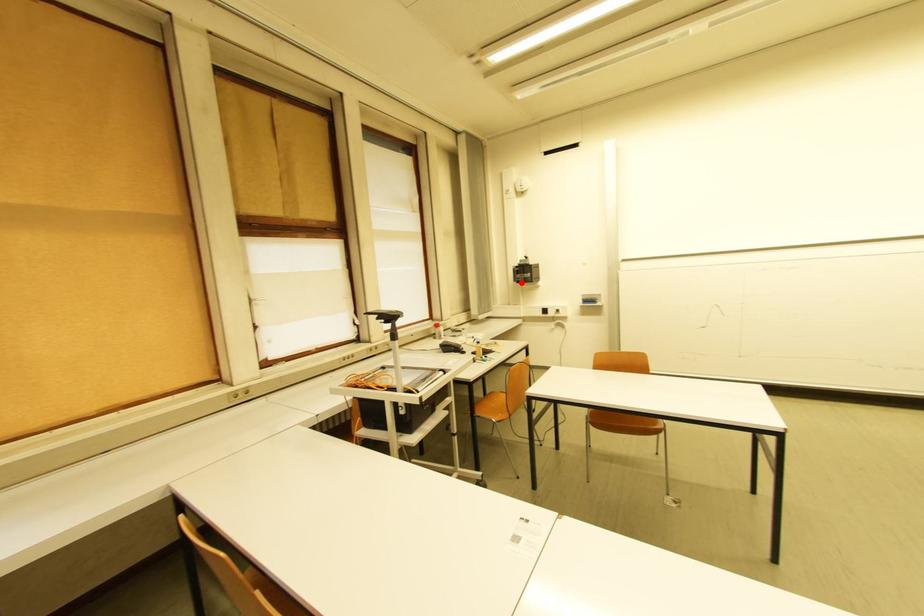
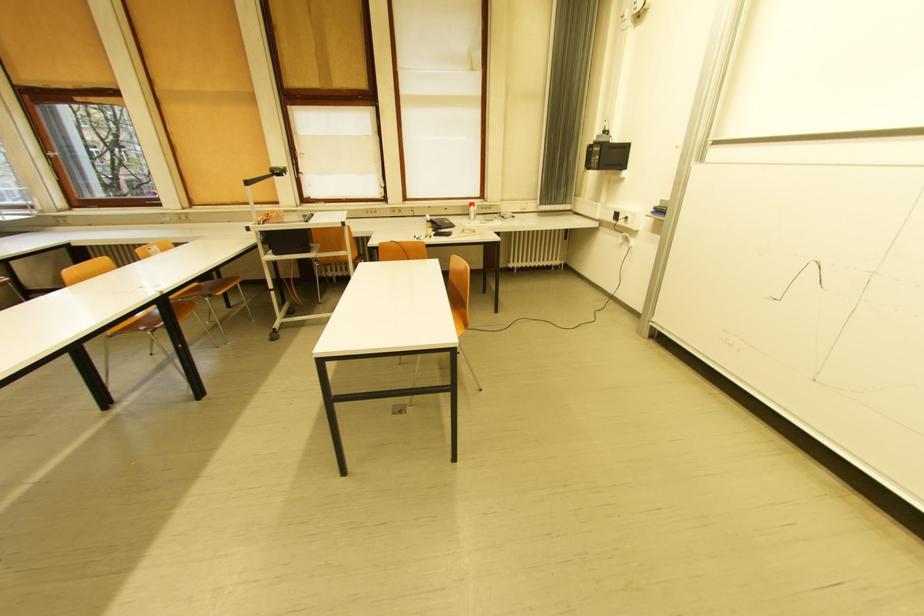
Find the pixel in the second image that matches the highlighted location in the first image.

(592, 168)